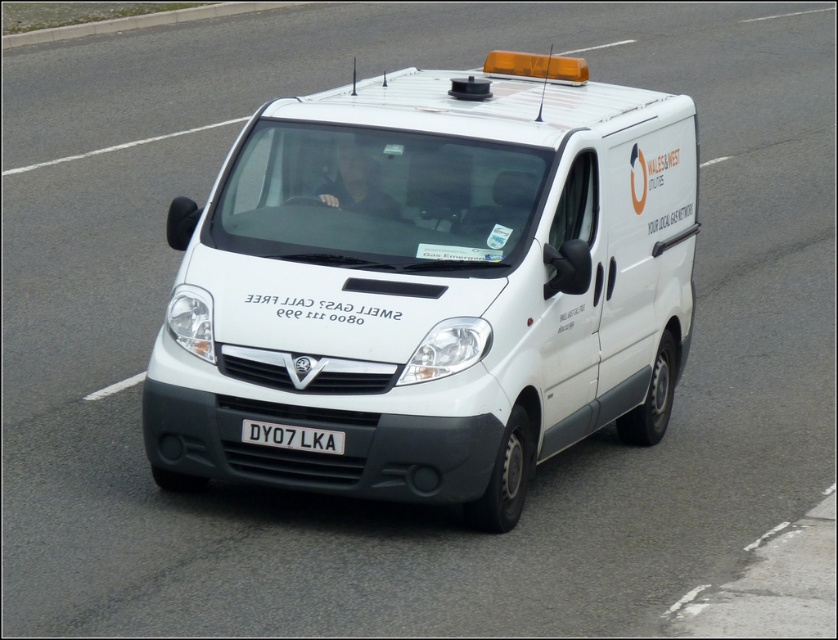
You are standing on the sidewalk and see the white matte van at center approaching you. If the van is moving at 15 km per hour, how many seconds will it take for the van to reach you?

The white matte van at center is 6.82 meters away from camera. At 15 km per hour, converting to meters per second is approximately 4.17 m per second. Dividing 6.82 meters by 4.17 m per second gives approximately 1.63 seconds. So, it will take about 1.63 seconds for the van to reach you.